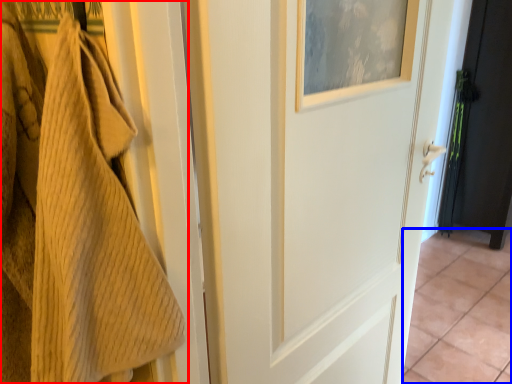
Question: Which of the following is the farthest to the observer, towel (highlighted by a red box) or tile (highlighted by a blue box)?

Choices:
 (A) towel
 (B) tile

Answer: (B)